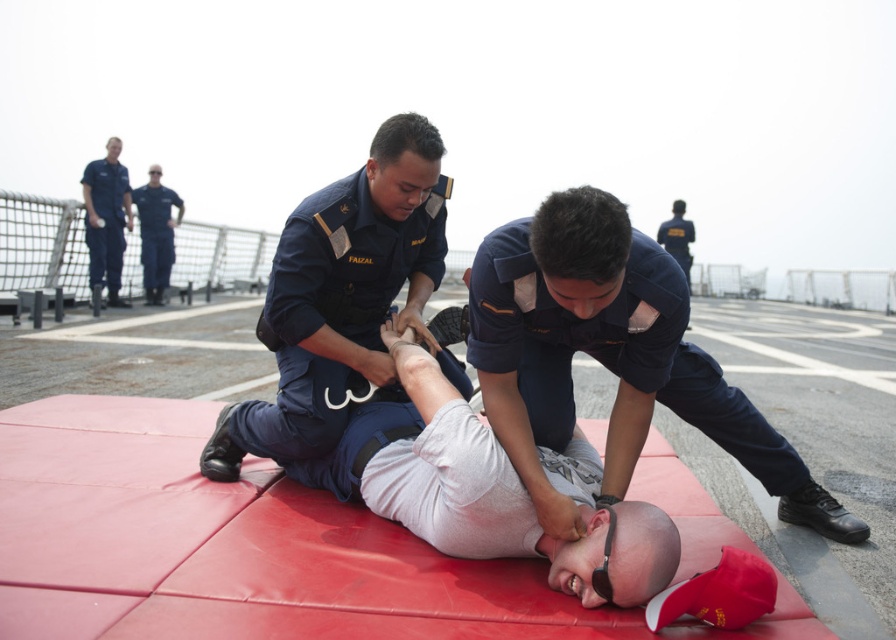
Is dark blue uniform at center positioned behind navy blue uniform at center?

That is False.

Measure the distance between dark blue uniform at center and navy blue uniform at center.

dark blue uniform at center is 34.13 inches from navy blue uniform at center.

Between point (632, 451) and point (369, 182), which one is positioned behind?

The point (369, 182) is behind.

At what (x,y) coordinates should I click in order to perform the action: click on dark blue uniform at center. Please return your answer as a coordinate pair (x, y). The height and width of the screenshot is (640, 896). Looking at the image, I should click on (610, 356).

Who is taller, navy blue uniform at center or dark blue uniform at upper left?

With more height is dark blue uniform at upper left.

Which is below, navy blue uniform at center or dark blue uniform at upper left?

navy blue uniform at center

The width and height of the screenshot is (896, 640). I want to click on navy blue uniform at center, so click(x=341, y=296).

At what (x,y) coordinates should I click in order to perform the action: click on navy blue uniform at center. Please return your answer as a coordinate pair (x, y). The height and width of the screenshot is (640, 896). Looking at the image, I should click on (341, 296).

Is navy blue uniform at center further to the viewer compared to blue uniform at upper left?

No.

Does navy blue uniform at center appear under blue uniform at upper left?

Indeed, navy blue uniform at center is positioned under blue uniform at upper left.

Is point (337, 324) closer to viewer compared to point (95, 225)?

Yes, it is in front of point (95, 225).

This screenshot has height=640, width=896. I want to click on navy blue uniform at center, so click(341, 296).